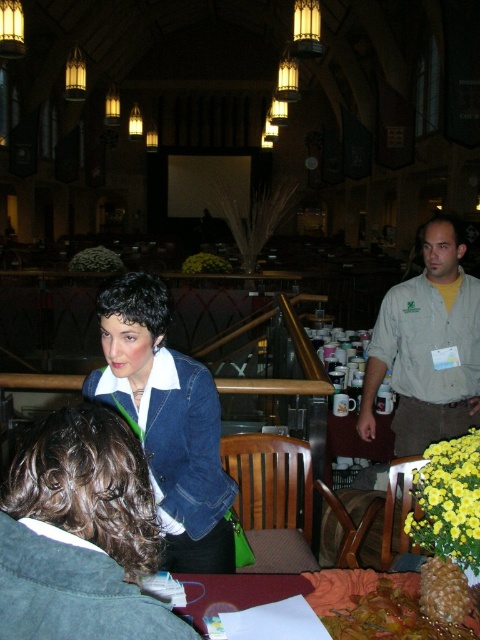
You are a photographer standing in the conference hall. You want to take a photo of the denim jacket at center and the khaki shirt at right. Can you fit both subjects into a single frame if your camera has a 5 feet wide field of view?

The distance between the denim jacket at center and khaki shirt at right is 4.82 feet, which is less than the 5 feet field of view of the camera. Therefore, both subjects can be captured in a single frame.

You are organizing a clothing display and need to arrange the denim jacket at center and khaki shirt at right in a specific order. According to the spatial arrangement in the image, which clothing item is positioned to the left of the other?

The denim jacket at center is positioned to the left of the khaki shirt at right.

Based on the photo, you are organizing a photo shoot in this conference hall and need to position two models wearing the denim jacket at center and the khaki shirt at right. Based on their clothing items, which one should you place closer to the camera to ensure both are fully visible in the frame?

The denim jacket at center is shorter than the khaki shirt at right, so you should place the denim jacket at center closer to the camera to ensure both are fully visible in the frame.